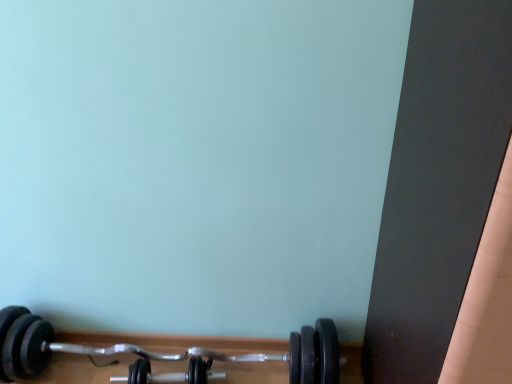
Question: Considering the relative positions of black rubber dumbbell at lower center, positioned as the second dumbbell in right-to-left order, and black rubber dumbbell at lower center, the 2th dumbbell when ordered from left to right, in the image provided, is black rubber dumbbell at lower center, positioned as the second dumbbell in right-to-left order, to the left or to the right of black rubber dumbbell at lower center, the 2th dumbbell when ordered from left to right,?

Choices:
 (A) left
 (B) right

Answer: (A)

Question: Is black rubber dumbbell at lower center, the 1th dumbbell positioned from the left, in front of or behind black rubber dumbbell at lower center, the 2th dumbbell when ordered from left to right, in the image?

Choices:
 (A) front
 (B) behind

Answer: (A)

Question: From the image's perspective, is black rubber dumbbell at lower center, the 1th dumbbell positioned from the left, located above or below black rubber dumbbell at lower center, the 1th dumbbell in the right-to-left sequence?

Choices:
 (A) above
 (B) below

Answer: (A)

Question: Would you say black rubber dumbbell at lower center, the 1th dumbbell in the right-to-left sequence, is inside or outside black rubber dumbbell at lower center, positioned as the second dumbbell in right-to-left order?

Choices:
 (A) outside
 (B) inside

Answer: (B)

Question: From the image's perspective, is black rubber dumbbell at lower center, the 1th dumbbell in the right-to-left sequence, located above or below black rubber dumbbell at lower center, the 1th dumbbell positioned from the left?

Choices:
 (A) above
 (B) below

Answer: (B)

Question: Looking at their shapes, would you say black rubber dumbbell at lower center, the 2th dumbbell when ordered from left to right, is wider or thinner than black rubber dumbbell at lower center, positioned as the second dumbbell in right-to-left order?

Choices:
 (A) wide
 (B) thin

Answer: (B)

Question: Considering their positions, is black rubber dumbbell at lower center, the 1th dumbbell in the right-to-left sequence, located in front of or behind black rubber dumbbell at lower center, the 1th dumbbell positioned from the left?

Choices:
 (A) front
 (B) behind

Answer: (B)